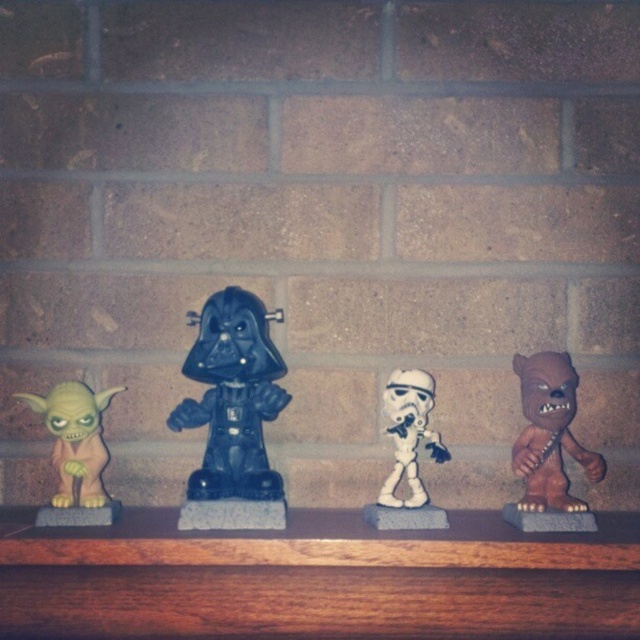
Question: Which object is farther from the camera taking this photo?

Choices:
 (A) matte black figure at center
 (B) brown wood shelf at center

Answer: (A)

Question: Which point is farther from the camera taking this photo?

Choices:
 (A) pos(428,564)
 (B) pos(58,518)
 (C) pos(390,413)

Answer: (C)

Question: Can you confirm if brown wood shelf at center is positioned to the right of matte black figure at center?

Choices:
 (A) no
 (B) yes

Answer: (B)

Question: Can you confirm if matte black figure at center is positioned to the right of white matte stormtrooper helmet at center?

Choices:
 (A) yes
 (B) no

Answer: (B)

Question: Estimate the real-world distances between objects in this image. Which object is closer to the matte black figure at center?

Choices:
 (A) brown wood shelf at center
 (B) brown matte chewbacca at right
 (C) white matte stormtrooper helmet at center
 (D) light brown rubber toy at left

Answer: (D)

Question: Can you confirm if light brown rubber toy at left is smaller than white matte stormtrooper helmet at center?

Choices:
 (A) no
 (B) yes

Answer: (A)